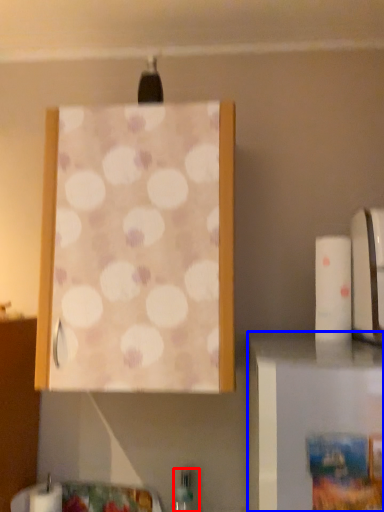
Question: Which of the following is the farthest to the observer, bottle (highlighted by a red box) or furniture (highlighted by a blue box)?

Choices:
 (A) bottle
 (B) furniture

Answer: (A)